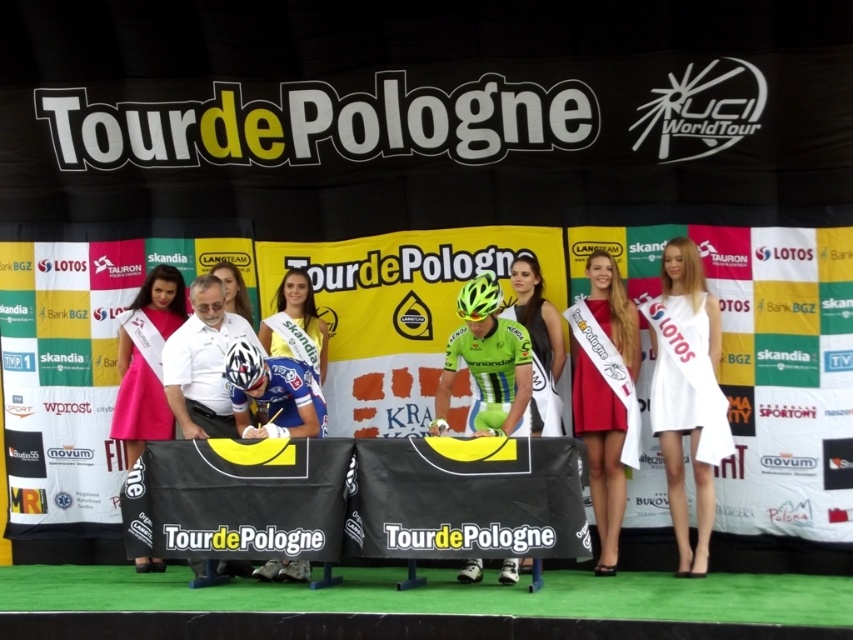
Question: Considering the real-world distances, which object is closest to the green matte jersey at center?

Choices:
 (A) green matte bicycle helmet at center
 (B) blue jersey at center
 (C) pink satin sash at center
 (D) white satin dress at center

Answer: (B)

Question: Is the position of green jersey at center more distant than that of yellow jersey at center?

Choices:
 (A) no
 (B) yes

Answer: (A)

Question: Observing the image, what is the correct spatial positioning of green matte jersey at center in reference to yellow-green matte bicycle helmet at center?

Choices:
 (A) left
 (B) right

Answer: (A)

Question: Estimate the real-world distances between objects in this image. Which object is closer to the pink satin sash at center?

Choices:
 (A) green matte bicycle helmet at center
 (B) pink satin dress at center

Answer: (B)

Question: Which of the following is the closest to the observer?

Choices:
 (A) green jersey at center
 (B) pink satin dress at center

Answer: (A)

Question: Can you confirm if white satin sash at center is thinner than pink satin sash at center?

Choices:
 (A) yes
 (B) no

Answer: (B)